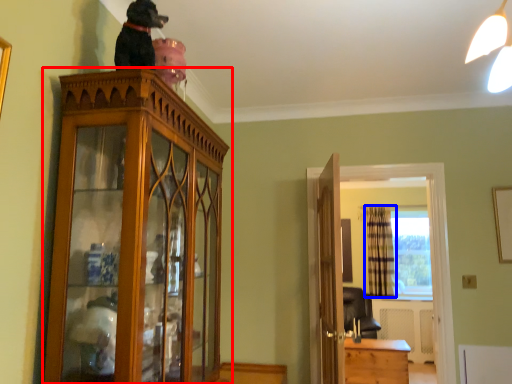
Question: Which object is closer to the camera taking this photo, cabinetry (highlighted by a red box) or curtain (highlighted by a blue box)?

Choices:
 (A) cabinetry
 (B) curtain

Answer: (A)